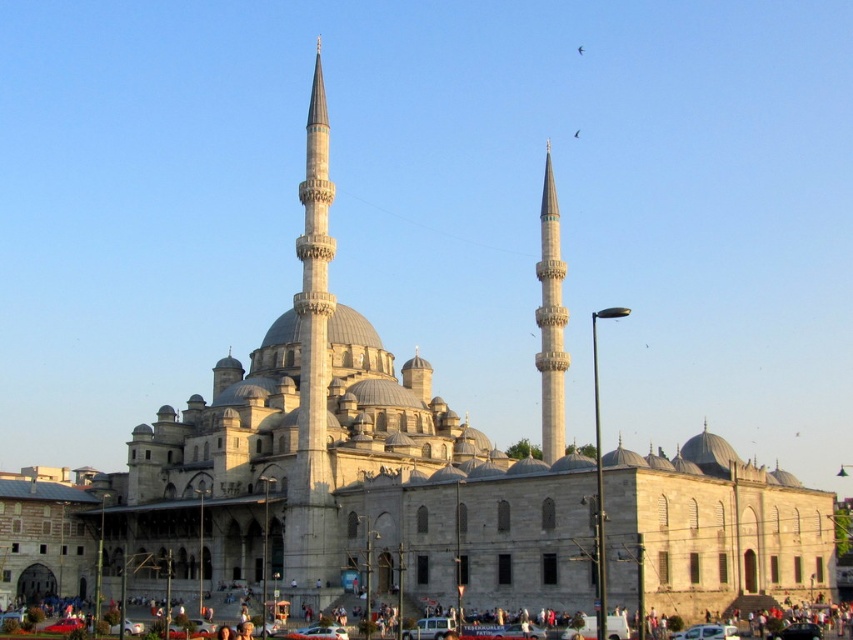
Does gray stone minaret at center have a larger size compared to white stone minaret at center?

Correct, gray stone minaret at center is larger in size than white stone minaret at center.

Which is below, gray stone minaret at center or white stone minaret at center?

white stone minaret at center is lower down.

Which is in front, point (303, 289) or point (555, 365)?

Point (303, 289) is more forward.

I want to click on gray stone minaret at center, so click(312, 365).